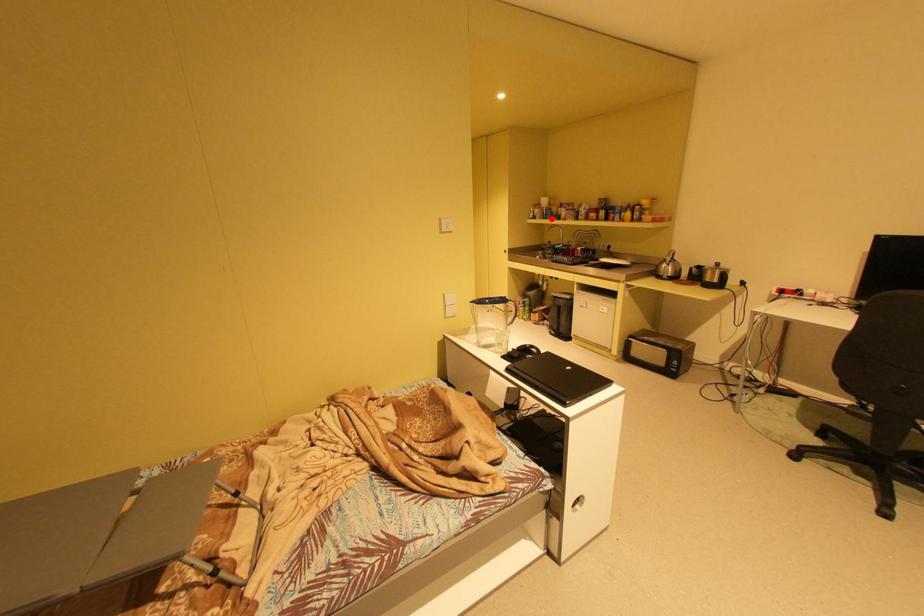
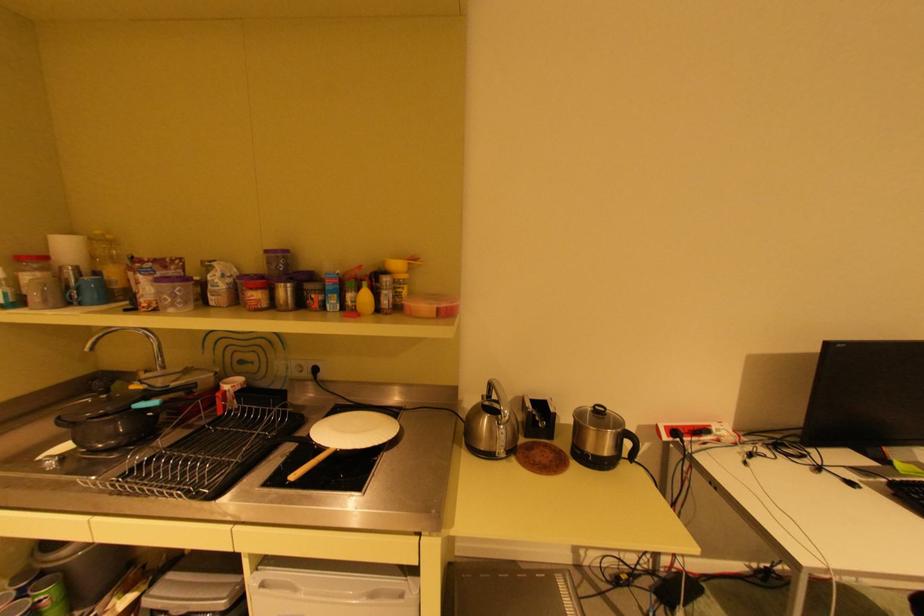
The point at the highlighted location is marked in the first image. Where is the corresponding point in the second image?

(79, 302)